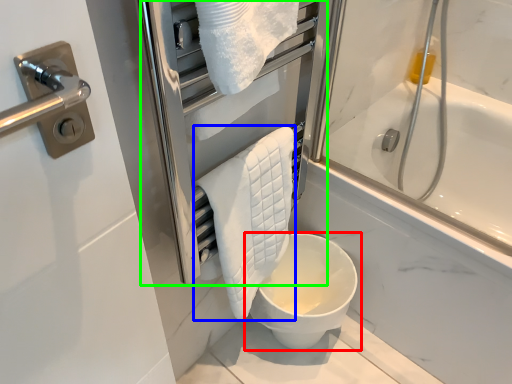
Question: Which object is the closest to the toilet (highlighted by a red box)? Choose among these: bath towel (highlighted by a blue box) or screen door (highlighted by a green box).

Choices:
 (A) bath towel
 (B) screen door

Answer: (A)